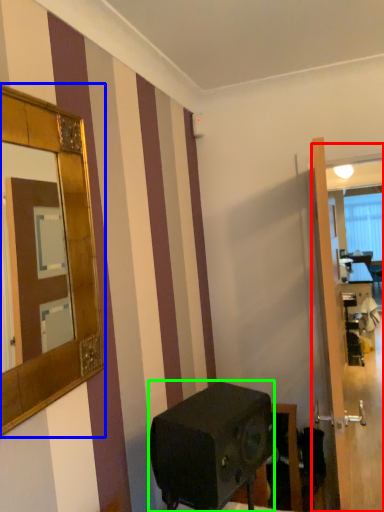
Question: Which object is positioned farthest from glass door (highlighted by a red box)? Select from mirror (highlighted by a blue box) and appliance (highlighted by a green box).

Choices:
 (A) mirror
 (B) appliance

Answer: (A)